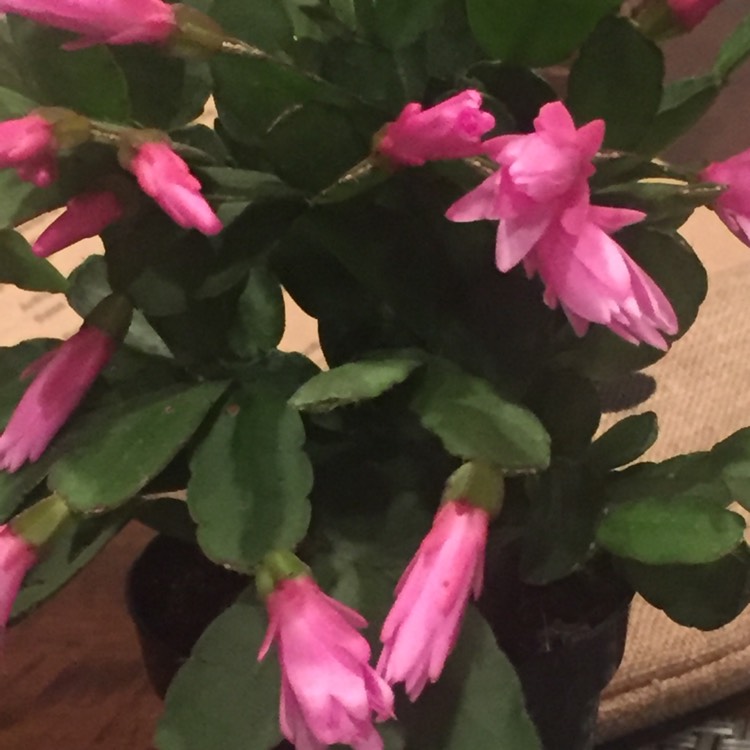
Locate an element on the screen. The image size is (750, 750). mat is located at coordinates (726, 393).